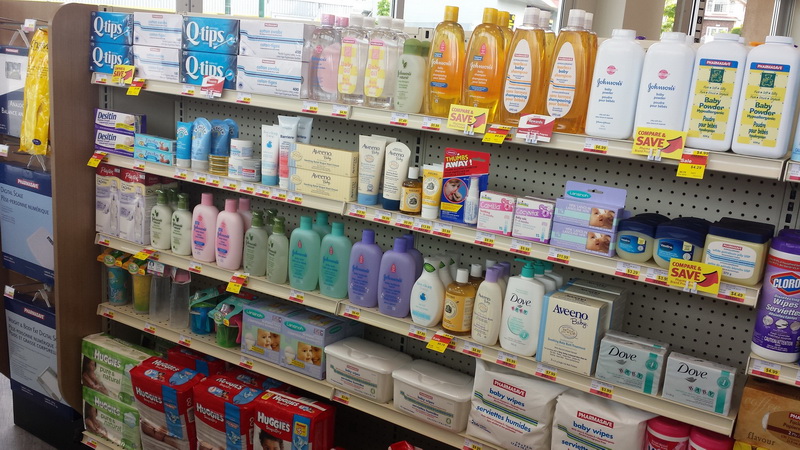
The width and height of the screenshot is (800, 450). In order to click on cardboard box in this screenshot , I will do `click(30, 224)`, `click(28, 353)`, `click(569, 233)`, `click(577, 224)`, `click(293, 62)`, `click(266, 42)`, `click(140, 145)`, `click(116, 127)`, `click(116, 143)`.